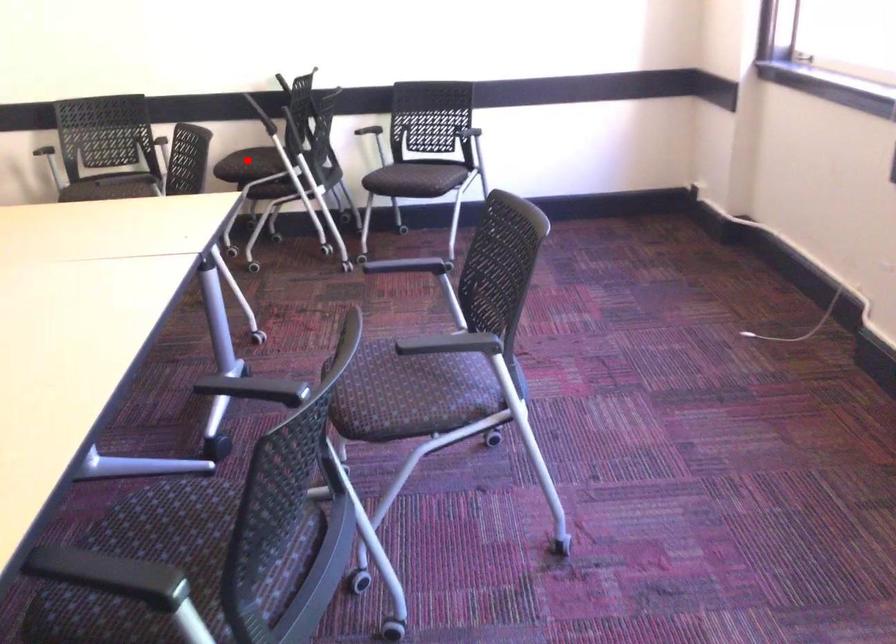
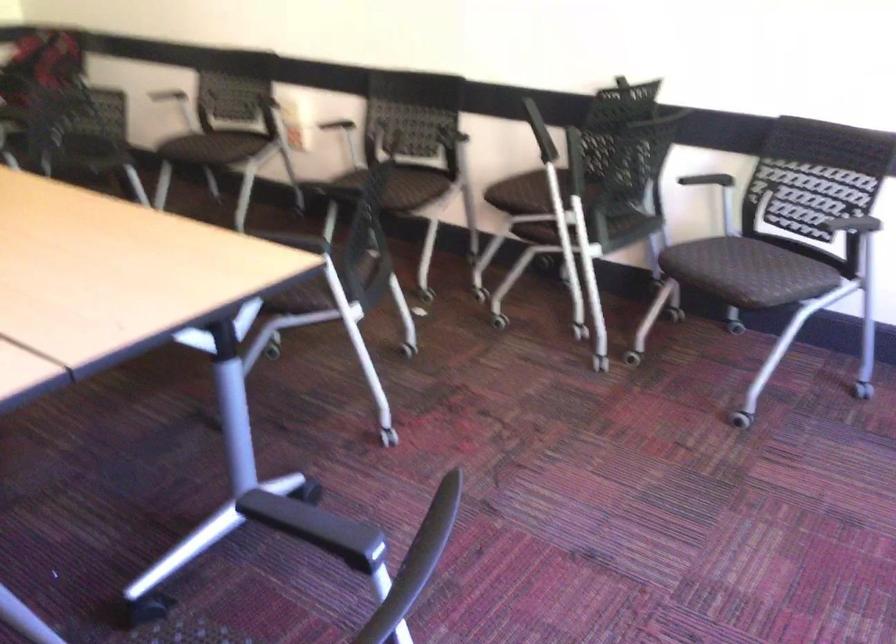
The point at the highlighted location is marked in the first image. Where is the corresponding point in the second image?

(526, 193)